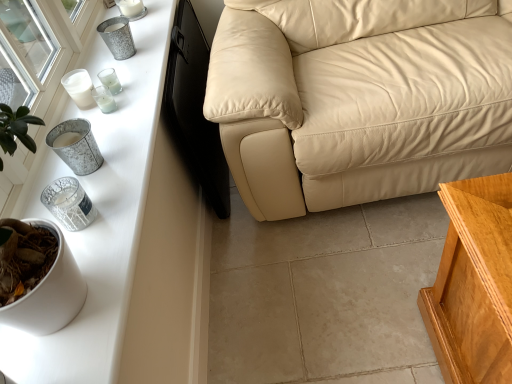
Question: Considering the positions of metallic glass candle holder at upper left, the fifth candle holder when ordered from bottom to top, and beige leather couch at center in the image, is metallic glass candle holder at upper left, the fifth candle holder when ordered from bottom to top, bigger or smaller than beige leather couch at center?

Choices:
 (A) big
 (B) small

Answer: (B)

Question: Is metallic glass candle holder at upper left, which is the second candle holder from top to bottom, inside or outside of beige leather couch at center?

Choices:
 (A) inside
 (B) outside

Answer: (B)

Question: Which of these objects is positioned closest to the metallic glass candle holder at upper left, the fifth candle holder when ordered from bottom to top?

Choices:
 (A) metallic glass candle at upper left, the fourth candle holder when ordered from top to bottom
 (B) white glossy table at left
 (C) metallic wire candle holder at left, which is the 1th candle holder from bottom to top
 (D) beige leather couch at center
 (E) metallic silver candle holder at left, which is the 5th candle holder from top to bottom

Answer: (A)

Question: Estimate the real-world distances between objects in this image. Which object is closer to the metallic wire candle holder at left, which is the 1th candle holder from bottom to top?

Choices:
 (A) beige leather couch at center
 (B) metallic textured candle holder at upper left, which ranks as the 1th candle holder in top-to-bottom order
 (C) metallic glass candle at upper left, the fourth candle holder when ordered from top to bottom
 (D) metallic glass candle holder at upper left, the fifth candle holder when ordered from bottom to top
 (E) metallic silver candle holder at left, the second candle holder in the bottom-to-top sequence

Answer: (E)